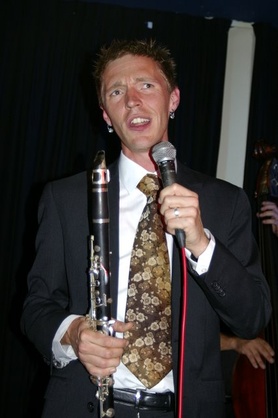
You are a GUI agent. You are given a task and a screenshot of the screen. Output one action in this format:
    pyautogui.click(x=<x>, y=<y>)
    Task: Click on the musical instruments
    The height and width of the screenshot is (418, 278).
    Given the screenshot: What is the action you would take?
    coord(98,283), coord(267,238)